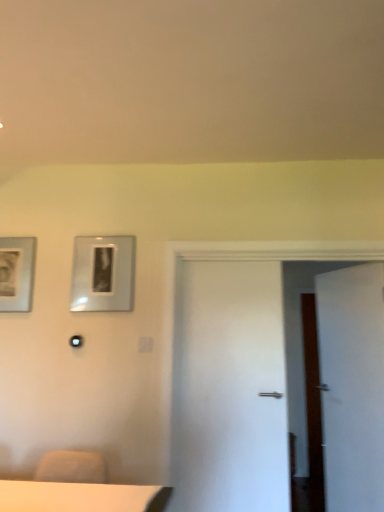
Question: Does matte silver picture frame at left, placed as the 1th picture frame when sorted from left to right, contain metallic silver picture frame at upper left, the second picture frame positioned from the left?

Choices:
 (A) yes
 (B) no

Answer: (B)

Question: Is metallic silver picture frame at upper left, the second picture frame positioned from the left, at the back of matte silver picture frame at left, placed as the 1th picture frame when sorted from left to right?

Choices:
 (A) no
 (B) yes

Answer: (A)

Question: Can you confirm if matte silver picture frame at left, placed as the 1th picture frame when sorted from left to right, is wider than metallic silver picture frame at upper left, the first picture frame from the right?

Choices:
 (A) no
 (B) yes

Answer: (B)

Question: Are matte silver picture frame at left, placed as the 1th picture frame when sorted from left to right, and metallic silver picture frame at upper left, the second picture frame positioned from the left, far apart?

Choices:
 (A) no
 (B) yes

Answer: (A)

Question: From the image's perspective, is matte silver picture frame at left, the second picture frame viewed from the right, under metallic silver picture frame at upper left, the first picture frame from the right?

Choices:
 (A) no
 (B) yes

Answer: (B)

Question: Looking at their shapes, would you say metallic silver picture frame at upper left, the second picture frame positioned from the left, is wider or thinner than matte silver picture frame at left, the second picture frame viewed from the right?

Choices:
 (A) thin
 (B) wide

Answer: (A)

Question: Based on their positions, is metallic silver picture frame at upper left, the first picture frame from the right, located to the left or right of matte silver picture frame at left, placed as the 1th picture frame when sorted from left to right?

Choices:
 (A) right
 (B) left

Answer: (A)

Question: Considering the positions of point (109, 273) and point (11, 279), is point (109, 273) closer or farther from the camera than point (11, 279)?

Choices:
 (A) closer
 (B) farther

Answer: (A)

Question: From the image's perspective, is metallic silver picture frame at upper left, the second picture frame positioned from the left, positioned above or below matte silver picture frame at left, the second picture frame viewed from the right?

Choices:
 (A) above
 (B) below

Answer: (A)

Question: Is white matte door at right wider or thinner than matte silver picture frame at left, the second picture frame viewed from the right?

Choices:
 (A) wide
 (B) thin

Answer: (A)

Question: Looking at the image, does white matte door at right seem bigger or smaller compared to matte silver picture frame at left, placed as the 1th picture frame when sorted from left to right?

Choices:
 (A) big
 (B) small

Answer: (A)

Question: Would you say white matte door at right is inside or outside matte silver picture frame at left, placed as the 1th picture frame when sorted from left to right?

Choices:
 (A) outside
 (B) inside

Answer: (A)

Question: From the image's perspective, relative to matte silver picture frame at left, placed as the 1th picture frame when sorted from left to right, is white matte door at right above or below?

Choices:
 (A) below
 (B) above

Answer: (A)

Question: Which is correct: metallic silver picture frame at upper left, the second picture frame positioned from the left, is inside white matte door at right, or outside of it?

Choices:
 (A) outside
 (B) inside

Answer: (A)

Question: Relative to white matte door at right, is metallic silver picture frame at upper left, the second picture frame positioned from the left, in front or behind?

Choices:
 (A) front
 (B) behind

Answer: (B)